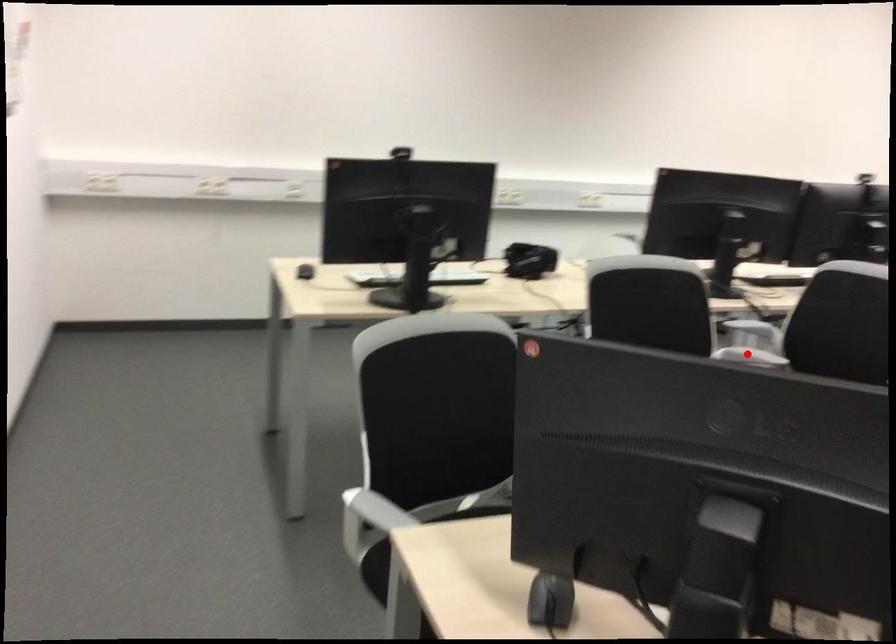
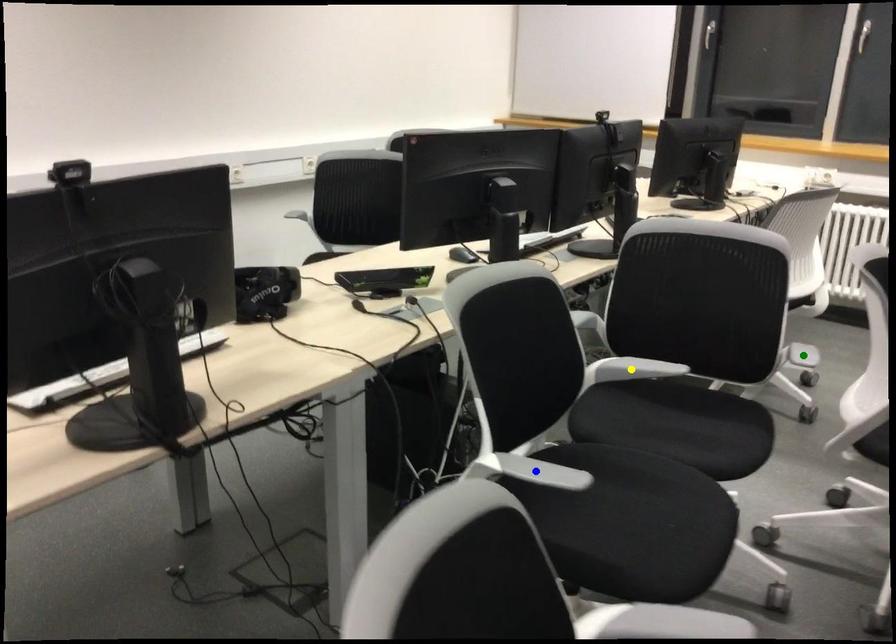
Question: I am providing you with two images of the same scene from different viewpoints. A red point is marked on the first image. You are given multiple points on the second image. In image 2, which mark is for the same physical point as the one in image 1?

Choices:
 (A) green point
 (B) yellow point
 (C) blue point

Answer: (B)